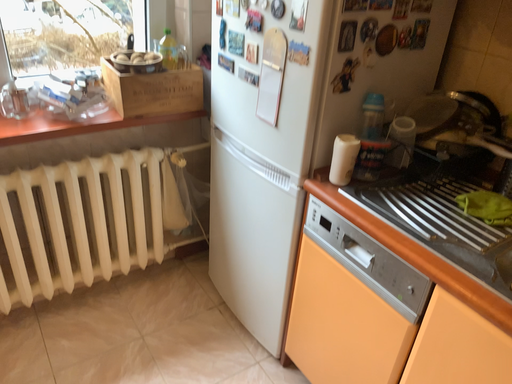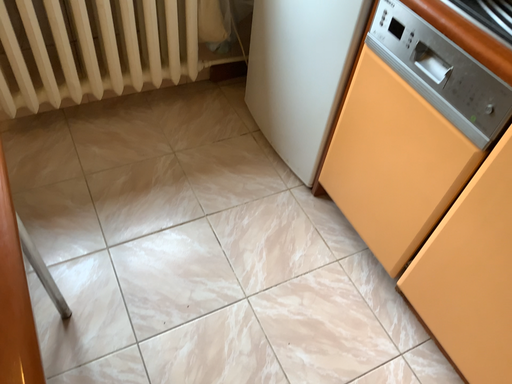
Question: Which way did the camera rotate in the video?

Choices:
 (A) rotated downward
 (B) rotated upward

Answer: (A)